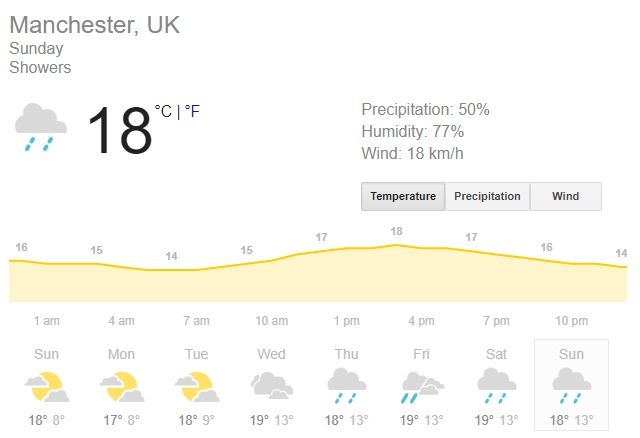
You are a GUI agent. You are given a task and a screenshot of the screen. Output one action in this format:
    pyautogui.click(x=<x>, y=<y>)
    Task: Click on the temperature button
    This screenshot has width=640, height=438.
    Given the screenshot: What is the action you would take?
    pyautogui.click(x=381, y=191)